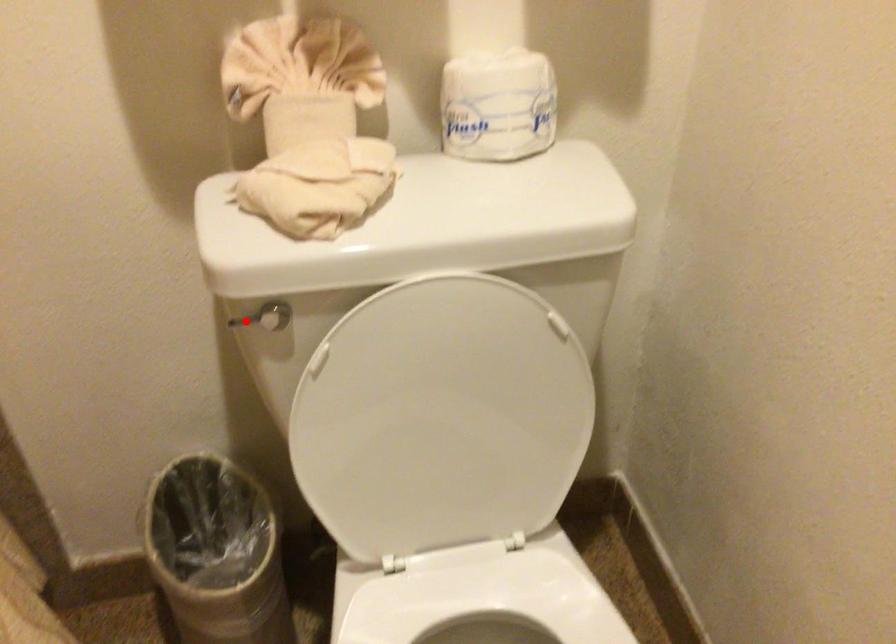
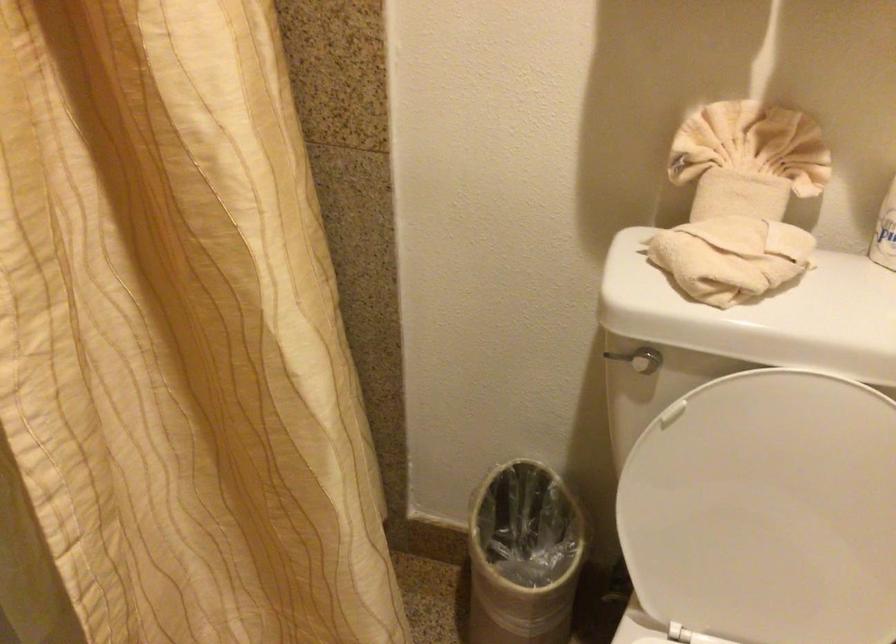
Question: I am providing you with two images of the same scene from different viewpoints. A red point is marked on the first image. Is the red point's position out of view in image 2?

Choices:
 (A) Yes
 (B) No

Answer: (B)